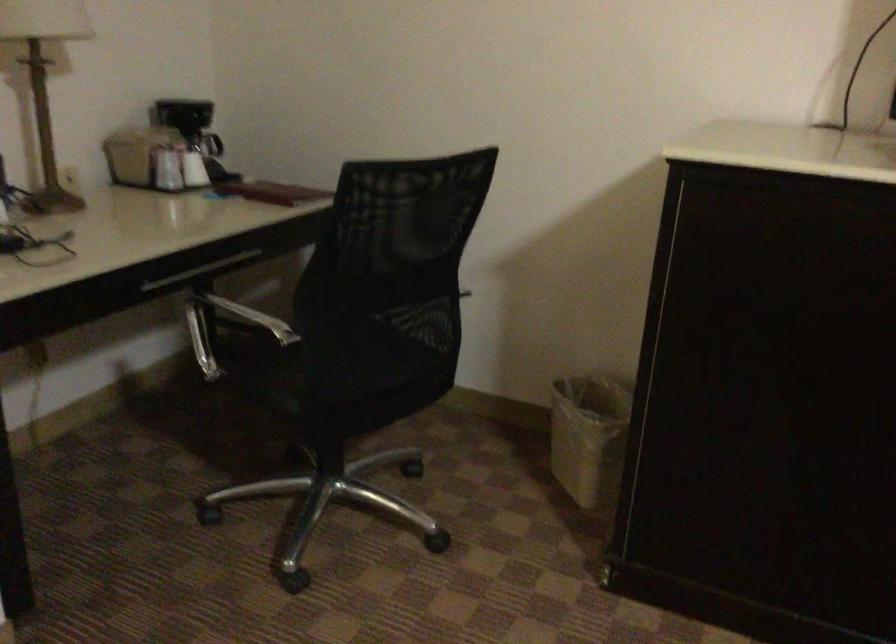
Where is `chrome chair armrest`? The width and height of the screenshot is (896, 644). chrome chair armrest is located at coordinates (227, 313).